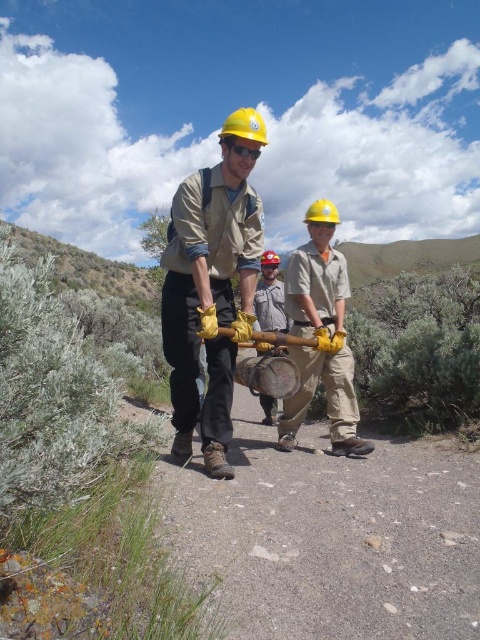
You are a safety inspector assessing the equipment in the image. The matte yellow hard hat at center and the brushed metal bucket at center are both at the center of the image. Which one has a greater width?

The matte yellow hard hat at center has a greater width than the brushed metal bucket at center.

You are a safety inspector at the construction site. You need to ensure that the matte yellow hard hat at center and the brushed metal bucket at center are placed at least 1.2 meters apart for safety regulations. Are they compliant with the safety distance requirement?

The matte yellow hard hat at center is 1.17 meters from the brushed metal bucket at center, which is less than the required 1.2 meters. Therefore, they are not compliant with the safety distance requirement.

You are a safety inspector observing the scene. You notice the matte yellow hard hat at center and the brushed metal bucket at center. Which object is positioned closer to your viewpoint?

The matte yellow hard hat at center is closer to the viewer than the brushed metal bucket at center.